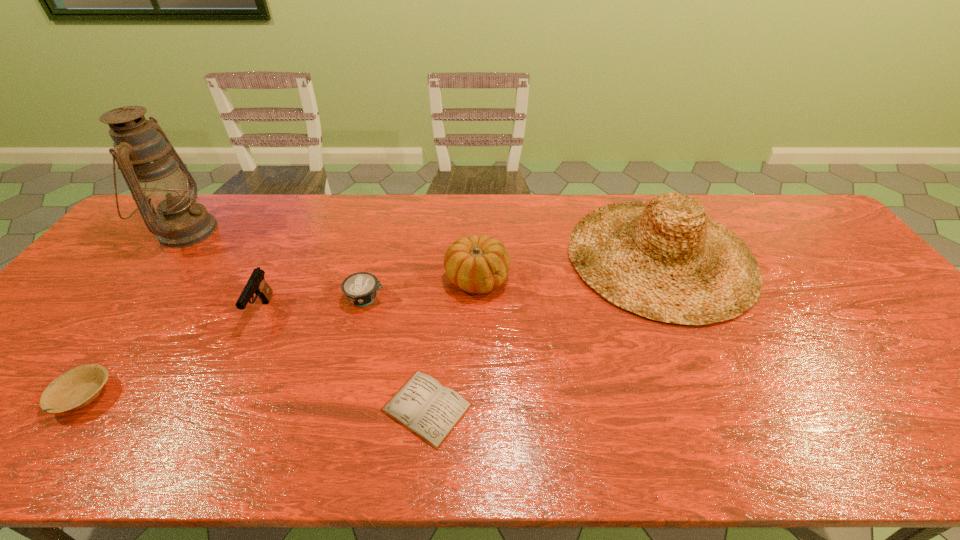
I want to click on oil lamp located in the left edge section of the desktop, so click(x=156, y=176).

Locate an element on the screen. The height and width of the screenshot is (540, 960). bowl located in the left edge section of the desktop is located at coordinates (78, 387).

The image size is (960, 540). I want to click on object that is positioned at the far left corner, so click(156, 176).

At what (x,y) coordinates should I click in order to perform the action: click on object at the near left corner. Please return your answer as a coordinate pair (x, y). Looking at the image, I should click on (78, 387).

You are a GUI agent. You are given a task and a screenshot of the screen. Output one action in this format:
    pyautogui.click(x=<x>, y=<y>)
    Task: Click on the vacant space at the far edge
    
    Given the screenshot: What is the action you would take?
    [x=471, y=235]

Locate an element on the screen. Image resolution: width=960 pixels, height=540 pixels. free region at the near edge of the desktop is located at coordinates (277, 440).

Locate an element on the screen. This screenshot has width=960, height=540. vacant region at the left edge of the desktop is located at coordinates (112, 260).

This screenshot has width=960, height=540. I want to click on free spot between the fifth tallest object and the bowl, so 225,347.

Find the location of a particular element. The width and height of the screenshot is (960, 540). free space between the gourd and the tallest object is located at coordinates (331, 255).

The height and width of the screenshot is (540, 960). Find the location of `free point between the bowl and the gourd`. free point between the bowl and the gourd is located at coordinates (280, 338).